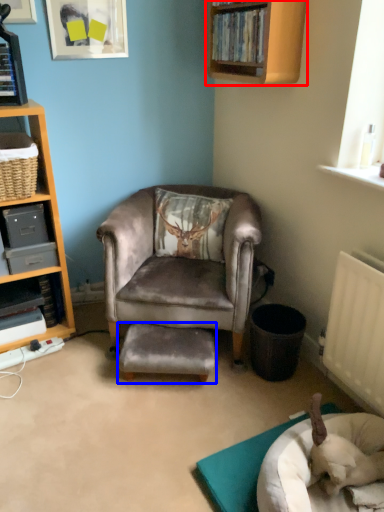
Question: Which object appears closest to the camera in this image, shelf (highlighted by a red box) or stool (highlighted by a blue box)?

Choices:
 (A) shelf
 (B) stool

Answer: (A)